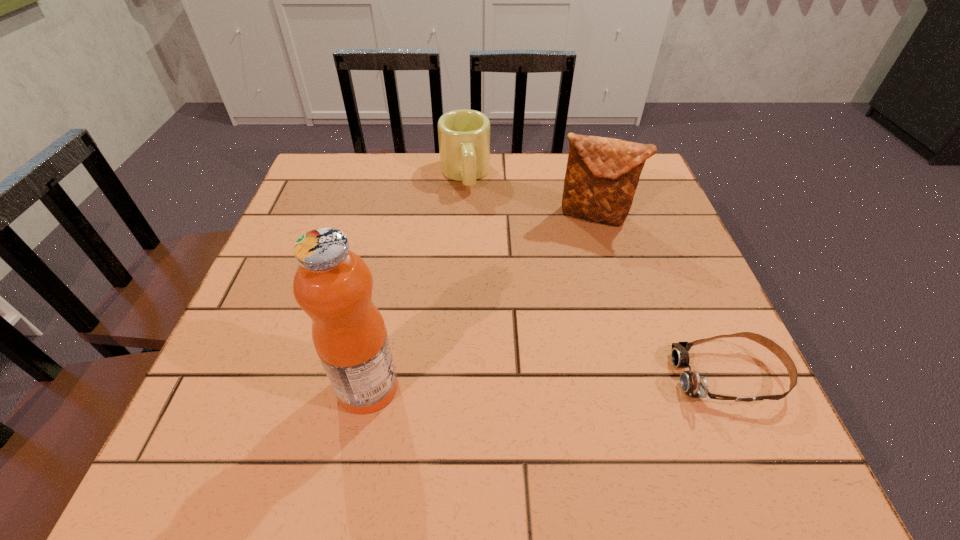
Where is `goggles that is at the near edge`? goggles that is at the near edge is located at coordinates (695, 386).

You are a GUI agent. You are given a task and a screenshot of the screen. Output one action in this format:
    pyautogui.click(x=<x>, y=<y>)
    Task: Click on the goggles that is at the right edge
    
    Given the screenshot: What is the action you would take?
    pyautogui.click(x=695, y=386)

Image resolution: width=960 pixels, height=540 pixels. I want to click on clutch bag that is positioned at the right edge, so click(x=602, y=174).

Image resolution: width=960 pixels, height=540 pixels. What are the coordinates of `object present at the far right corner` in the screenshot? It's located at (602, 174).

Identify the location of object that is at the near right corner. The height and width of the screenshot is (540, 960). (695, 386).

The width and height of the screenshot is (960, 540). What are the coordinates of `free space at the far edge of the desktop` in the screenshot? It's located at (401, 164).

The height and width of the screenshot is (540, 960). In the image, there is a desktop. What are the coordinates of `free space at the near edge` in the screenshot? It's located at (580, 387).

The height and width of the screenshot is (540, 960). I want to click on vacant region at the left edge of the desktop, so click(x=296, y=303).

Identify the location of vacant space at the right edge of the desktop. (719, 333).

The height and width of the screenshot is (540, 960). Find the location of `vacant space at the near left corner of the desktop`. vacant space at the near left corner of the desktop is located at coordinates (271, 368).